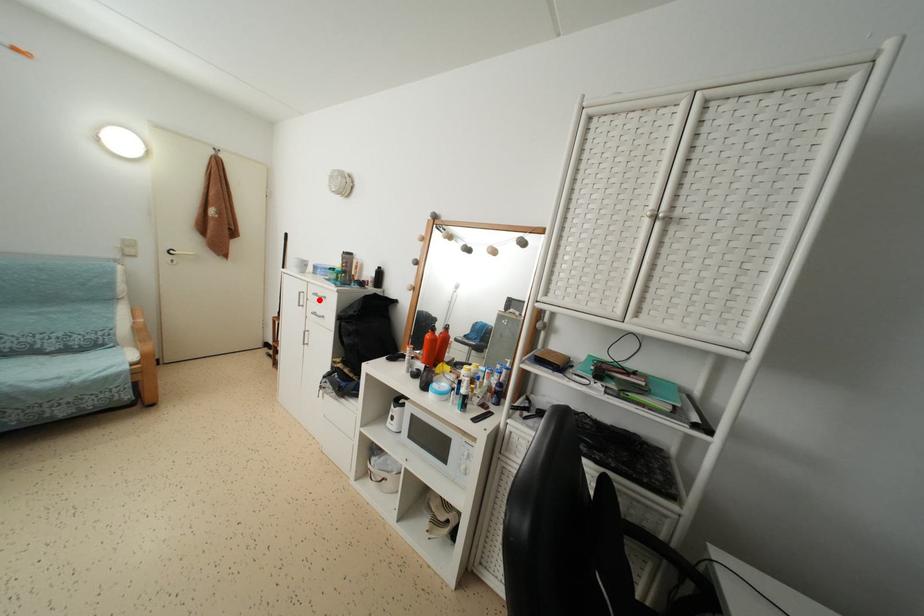
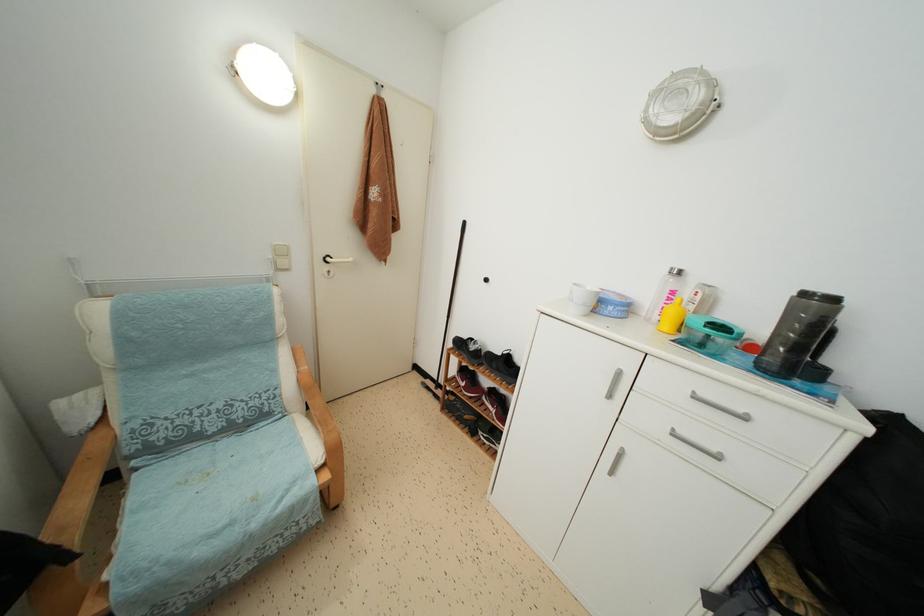
Locate, in the second image, the point that corresponds to the highlighted location in the first image.

(699, 402)